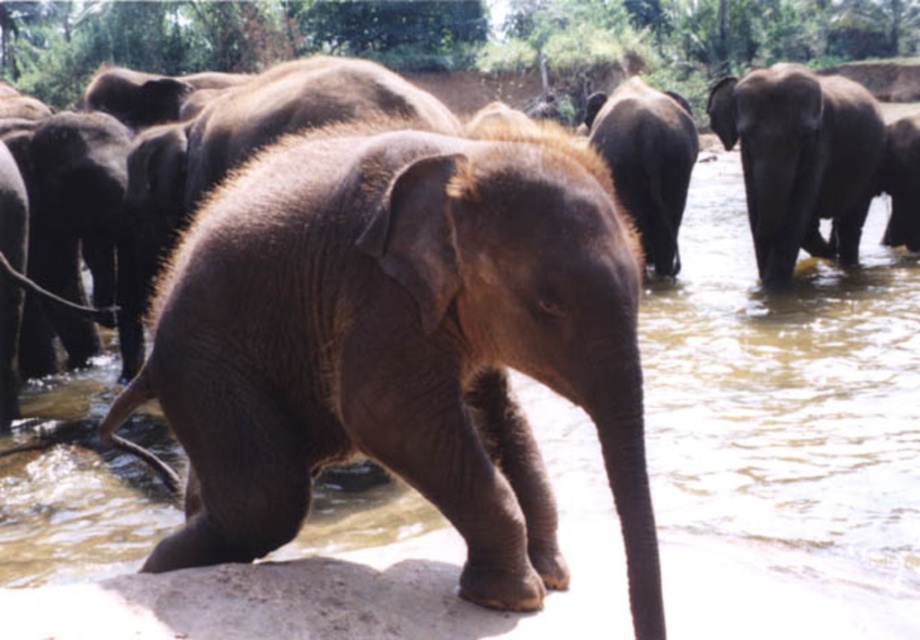
Does smooth brown elephant at center appear over grayish-brown textured elephant at right?

Incorrect, smooth brown elephant at center is not positioned above grayish-brown textured elephant at right.

Between smooth brown elephant at center and grayish-brown textured elephant at right, which one appears on the left side from the viewer's perspective?

Positioned to the left is smooth brown elephant at center.

Describe the element at coordinates (400, 346) in the screenshot. I see `smooth brown elephant at center` at that location.

Locate an element on the screen. smooth brown elephant at center is located at coordinates (400, 346).

Which is above, smooth brown elephant at center or dark brown wrinkled elephant at center?

dark brown wrinkled elephant at center is higher up.

The width and height of the screenshot is (920, 640). What do you see at coordinates (400, 346) in the screenshot? I see `smooth brown elephant at center` at bounding box center [400, 346].

Identify the location of smooth brown elephant at center. This screenshot has width=920, height=640. (400, 346).

Between dark brown wrinkled elephant at right and dark brown wrinkled elephant at center, which one has less height?

dark brown wrinkled elephant at right is shorter.

Which is in front, point (752, 72) or point (677, 141)?

Point (677, 141)

Find the location of a particular element. This screenshot has height=640, width=920. dark brown wrinkled elephant at right is located at coordinates (800, 161).